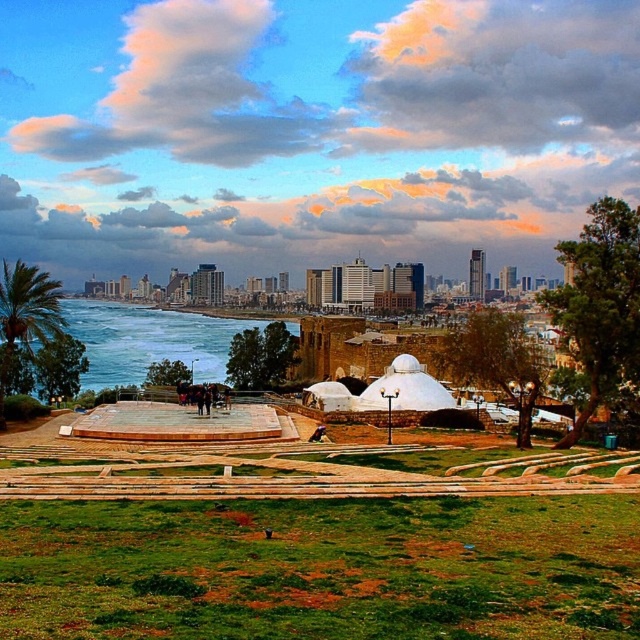
Question: Among these objects, which one is farthest from the camera?

Choices:
 (A) blue ocean water at lower left
 (B) green leafy palm tree at left

Answer: (A)

Question: Which object is closer to the camera taking this photo?

Choices:
 (A) blue ocean water at lower left
 (B) green leafy palm tree at left

Answer: (B)

Question: Is the position of blue ocean water at lower left more distant than that of green leafy palm tree at left?

Choices:
 (A) yes
 (B) no

Answer: (A)

Question: Is blue ocean water at lower left below green leafy palm tree at left?

Choices:
 (A) yes
 (B) no

Answer: (A)

Question: Is blue ocean water at lower left positioned behind green leafy palm tree at left?

Choices:
 (A) no
 (B) yes

Answer: (B)